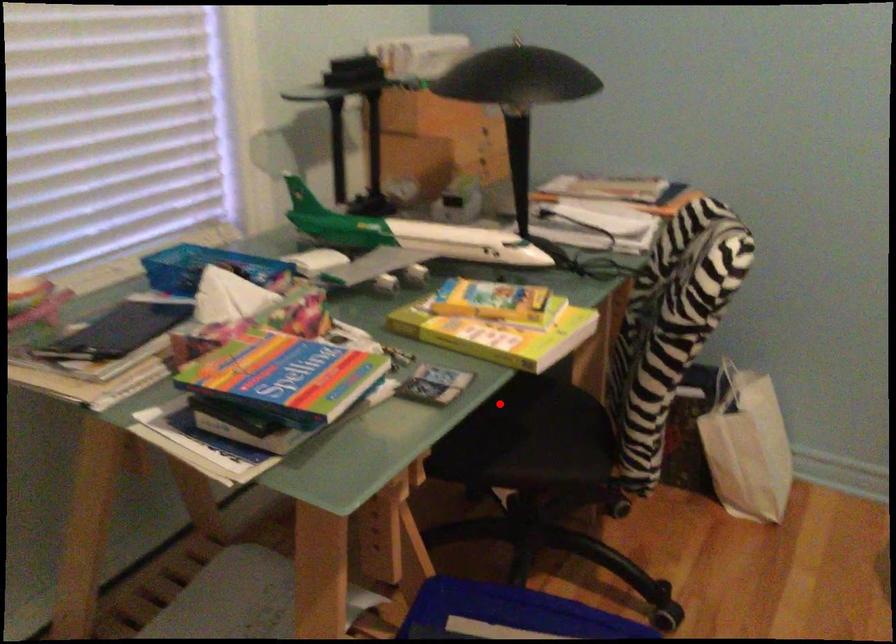
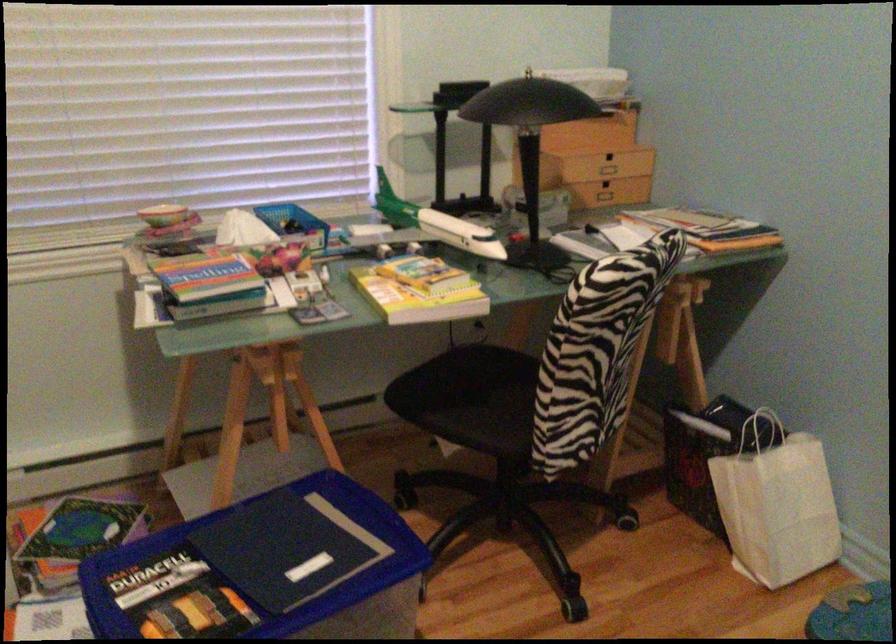
In the second image, find the point that corresponds to the highlighted location in the first image.

(487, 377)